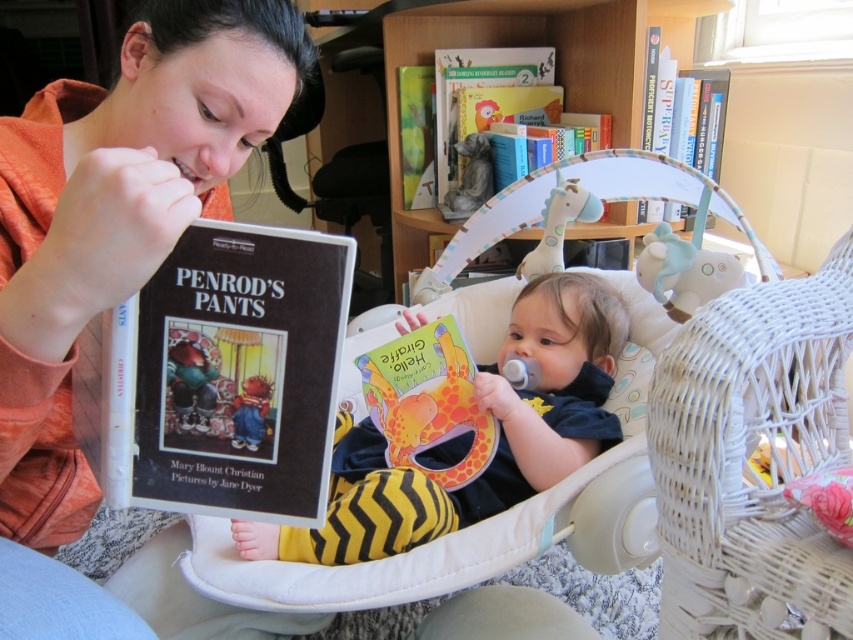
You are a parent trying to place a toy airplane between the yellow zigzag pants at center and the hardcover book at upper right. The toy airplane requires 12 inches of space. Can you fit it there?

The yellow zigzag pants at center is 30.60 inches from the hardcover book at upper right. Since the toy airplane requires 12 inches of space, there is enough room to place it between them.

You are a parent holding a baby in a white wicker baby swing. You want to place a new book on the wooden bookshelf at upper center. If the book is 0.3 meters thick, will it fit on the shelf?

The wooden bookshelf at upper center is 1.59 meters away from the viewer. The distance to the bookshelf does not affect the book thickness. The question about the book fitting on the shelf cannot be answered with the provided information about distance.

What is the spatial relationship between the yellow zigzag pants at center and the other objects in the scene?

The yellow zigzag pants at center are positioned at coordinates point (497, 442).